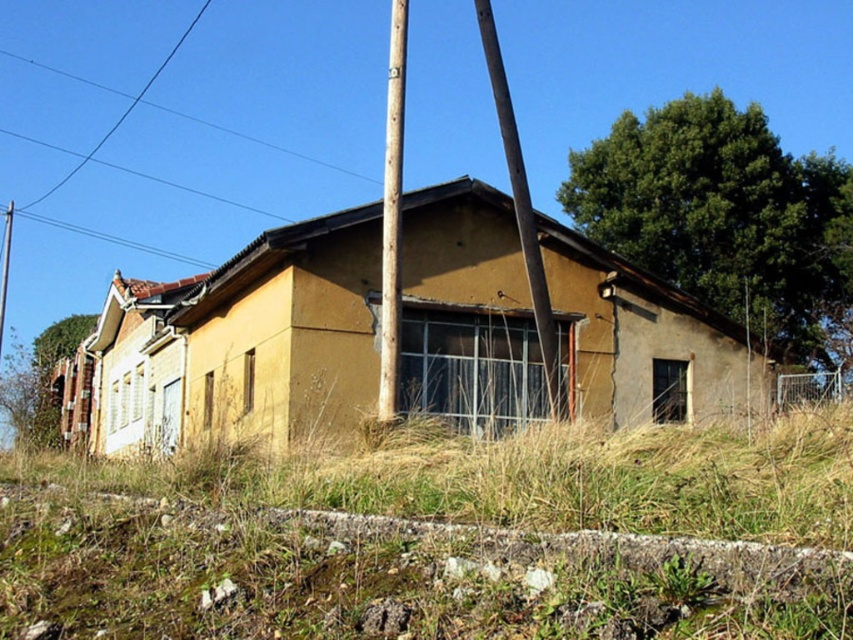
Question: Which of the following is the farthest from the observer?

Choices:
 (A) (512, 166)
 (B) (0, 344)
 (C) (376, 417)
 (D) (57, 332)

Answer: (B)

Question: Which object is positioned farthest from the green leafy tree at upper right?

Choices:
 (A) green leafy tree at upper left
 (B) wooden pole at center

Answer: (A)

Question: Does dry grass at lower center appear on the right side of brown wooden pole at center?

Choices:
 (A) yes
 (B) no

Answer: (A)

Question: Can you confirm if green leafy tree at upper right is thinner than wooden pole at center?

Choices:
 (A) no
 (B) yes

Answer: (A)

Question: Which point is farther from the camera taking this photo?

Choices:
 (A) (387, 80)
 (B) (67, 340)
 (C) (1, 346)
 (D) (233, 616)

Answer: (A)

Question: Considering the relative positions of brown wooden pole at center and metallic pole at left in the image provided, where is brown wooden pole at center located with respect to metallic pole at left?

Choices:
 (A) above
 (B) below

Answer: (A)